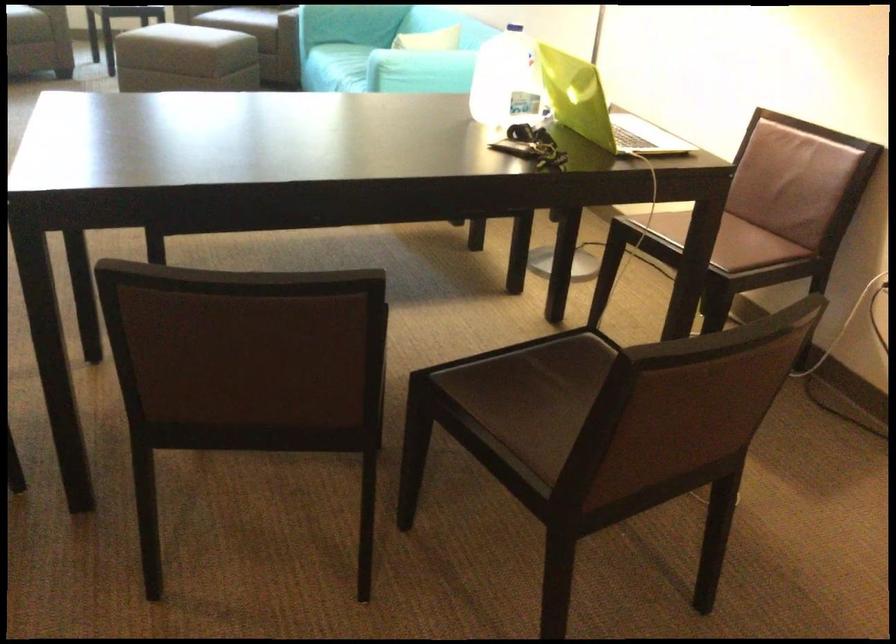
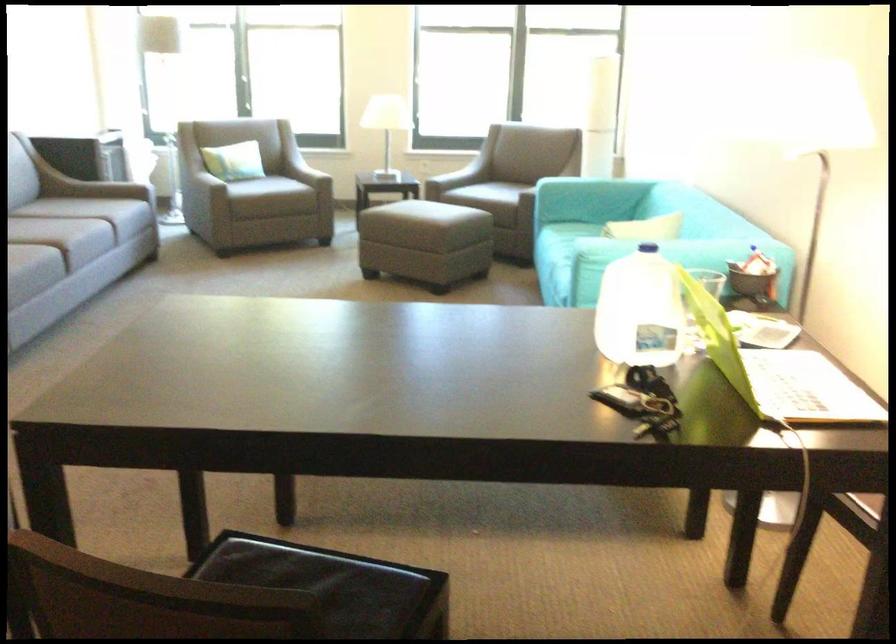
First-person continuous shooting, in which direction is the camera rotating?

The rotation direction of the camera is right-down.